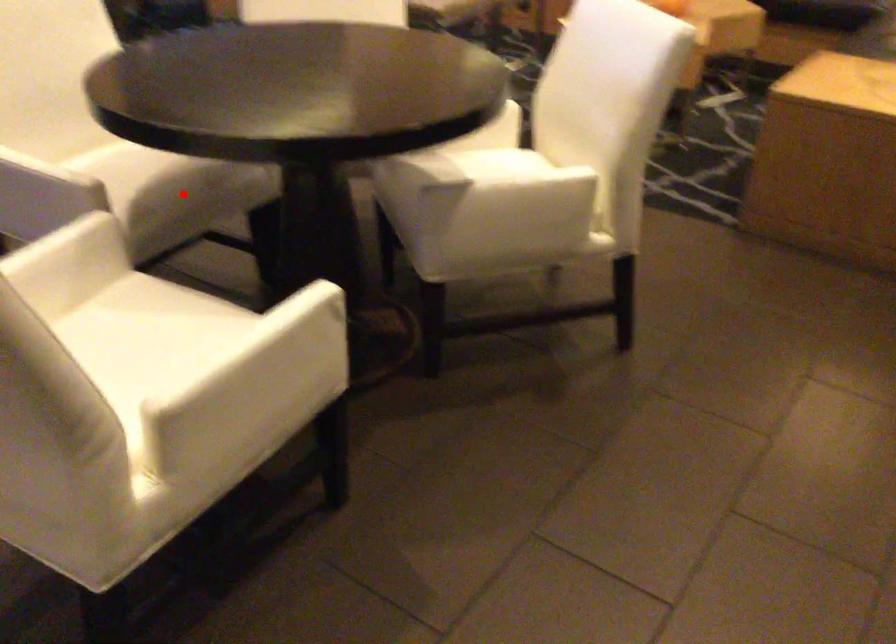
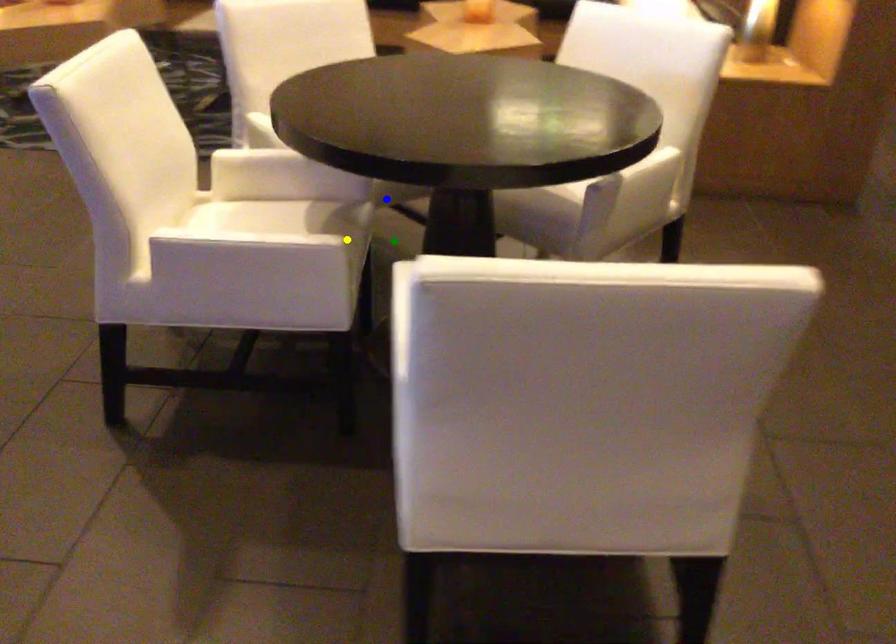
Question: I am providing you with two images of the same scene from different viewpoints. A red point is marked on the first image. You are given multiple points on the second image. Which point in image 2 is actually the same real-world point as the red point in image 1?

Choices:
 (A) blue point
 (B) yellow point
 (C) green point

Answer: (B)